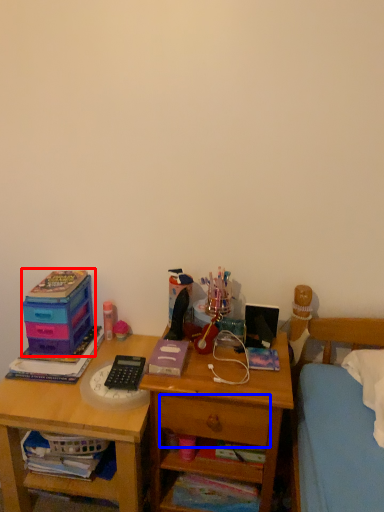
Question: Among these objects, which one is nearest to the camera, storage box (highlighted by a red box) or drawer (highlighted by a blue box)?

Choices:
 (A) storage box
 (B) drawer

Answer: (B)